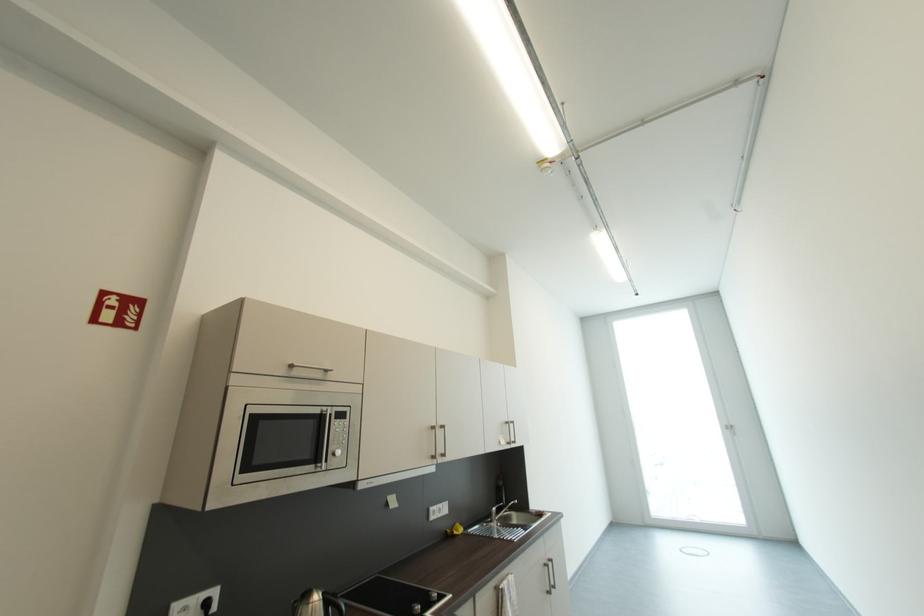
What are the coordinates of `metal faucet handle` in the screenshot? It's located at (503, 530).